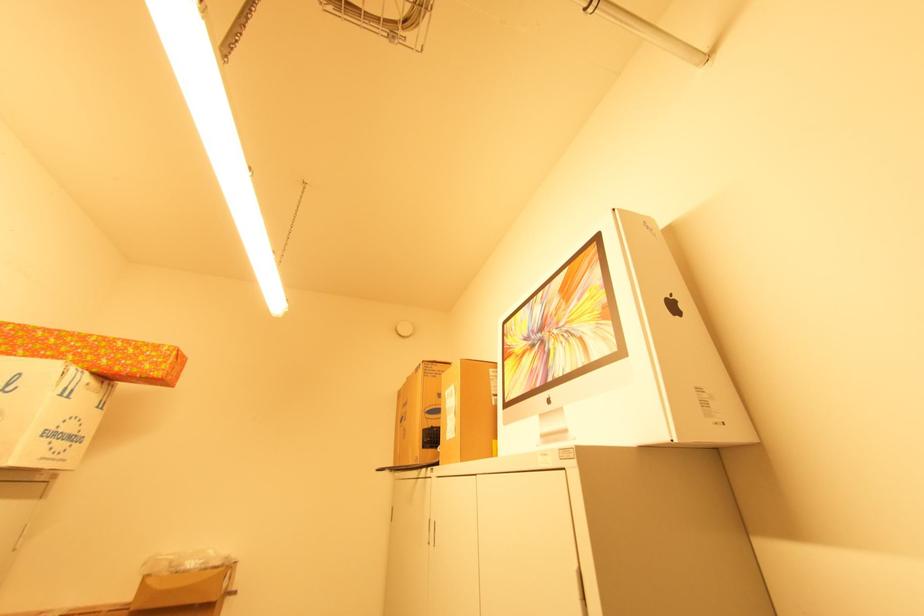
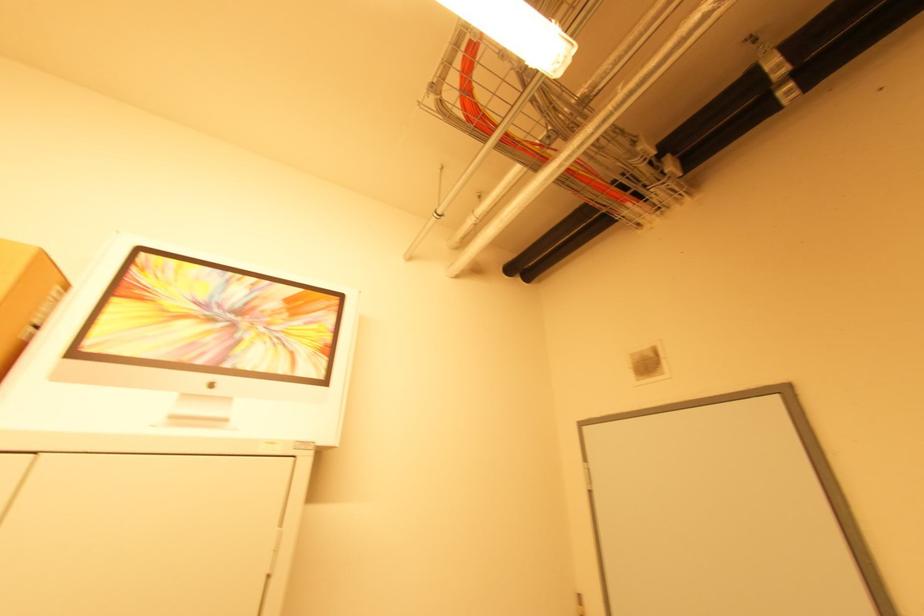
Consider the image. The images are taken continuously from a first-person perspective. In which direction is your viewpoint rotating?

The camera rotated toward right-up.